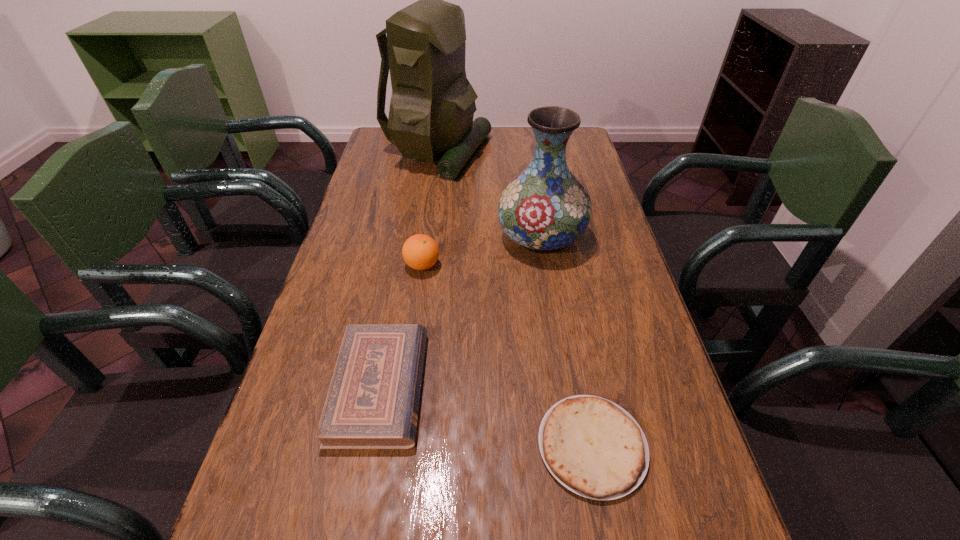
This screenshot has width=960, height=540. I want to click on object that can be found as the second closest to the shortest object, so click(545, 208).

You are a GUI agent. You are given a task and a screenshot of the screen. Output one action in this format:
    pyautogui.click(x=<x>, y=<y>)
    Task: Click on the vacant space that satisfies the following two spatial constraints: 1. on the front of the fourth shortest object with visible pockets; 2. on the right side of the farthest object
    This screenshot has height=540, width=960.
    Given the screenshot: What is the action you would take?
    pyautogui.click(x=425, y=237)

The height and width of the screenshot is (540, 960). I want to click on free spot that satisfies the following two spatial constraints: 1. on the front of the tallest object with visible pockets; 2. on the back side of the shortest object, so click(x=396, y=446).

Image resolution: width=960 pixels, height=540 pixels. I want to click on free location that satisfies the following two spatial constraints: 1. on the spine side of the tortilla; 2. on the right side of the second shortest object, so click(x=369, y=446).

The height and width of the screenshot is (540, 960). I want to click on vacant space that satisfies the following two spatial constraints: 1. on the front of the second tallest object with visible pockets; 2. on the right side of the backpack, so click(x=425, y=237).